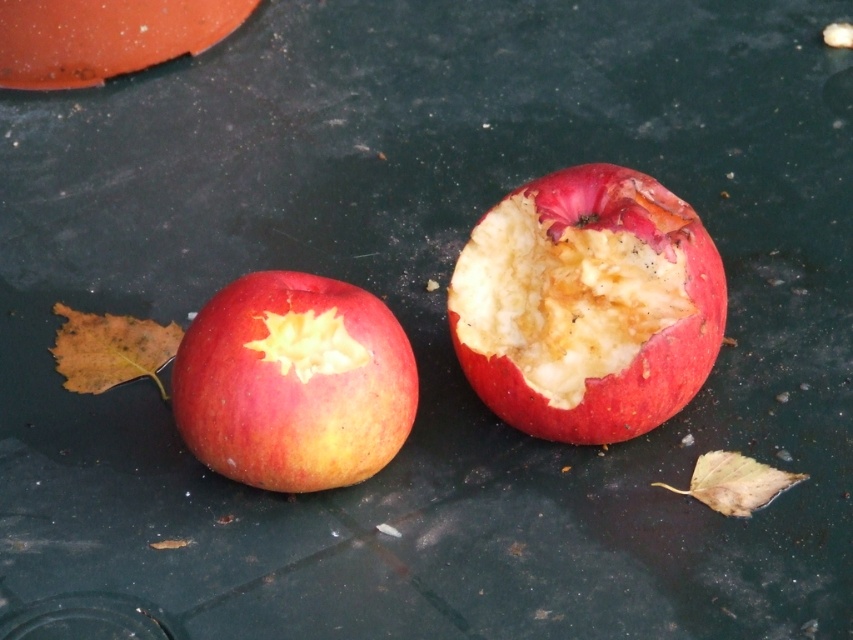
Between point (614, 353) and point (229, 406), which one is positioned in front?

Point (229, 406) is in front.

The width and height of the screenshot is (853, 640). Identify the location of red matte apple at center. (587, 305).

Who is more forward, [567,401] or [260,458]?

Point [260,458] is in front.

Image resolution: width=853 pixels, height=640 pixels. I want to click on red matte apple at center, so click(x=587, y=305).